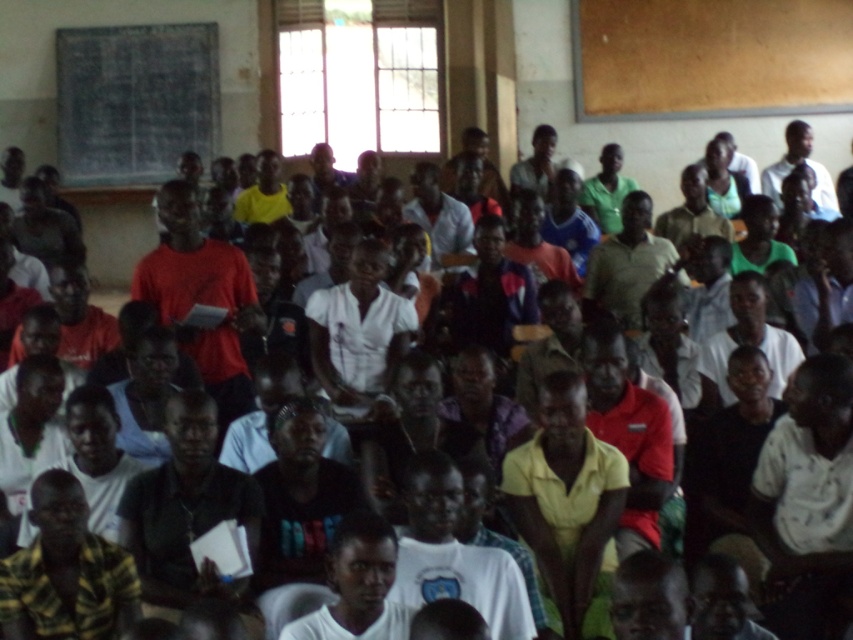
You are a student sitting in the classroom and need to write something on the blackboard at upper left. Can you reach it while standing in front of the matte red shirt at center?

The blackboard at upper left is located above the matte red shirt at center, so yes, you can reach it by standing in front of the matte red shirt at center and stretching upwards.